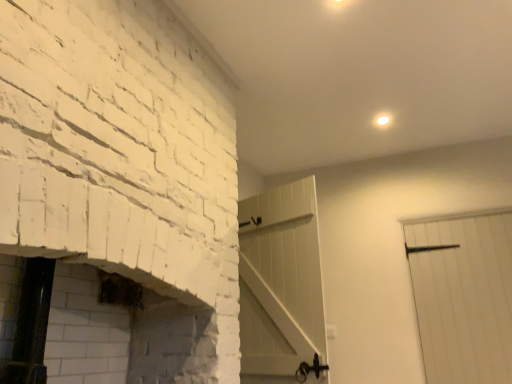
At what (x,y) coordinates should I click in order to perform the action: click on white wood door at right. Please return your answer as a coordinate pair (x, y). The height and width of the screenshot is (384, 512). Looking at the image, I should click on (463, 295).

What do you see at coordinates (463, 295) in the screenshot? The height and width of the screenshot is (384, 512). I see `white wood door at right` at bounding box center [463, 295].

The height and width of the screenshot is (384, 512). Identify the location of white wood door at right. (463, 295).